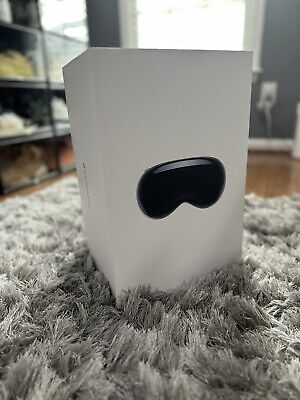
Find the location of a particular element. This screenshot has height=400, width=300. outlet is located at coordinates (270, 98).